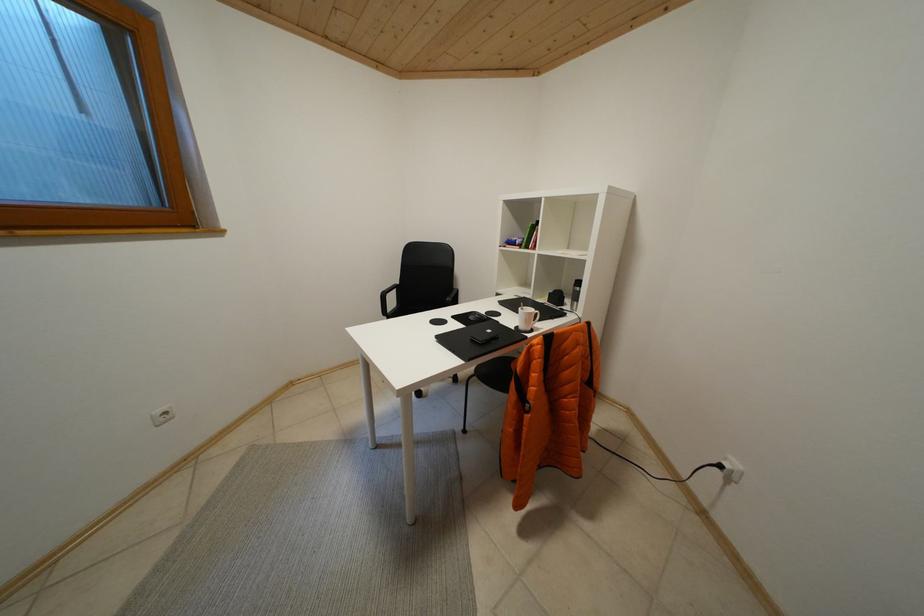
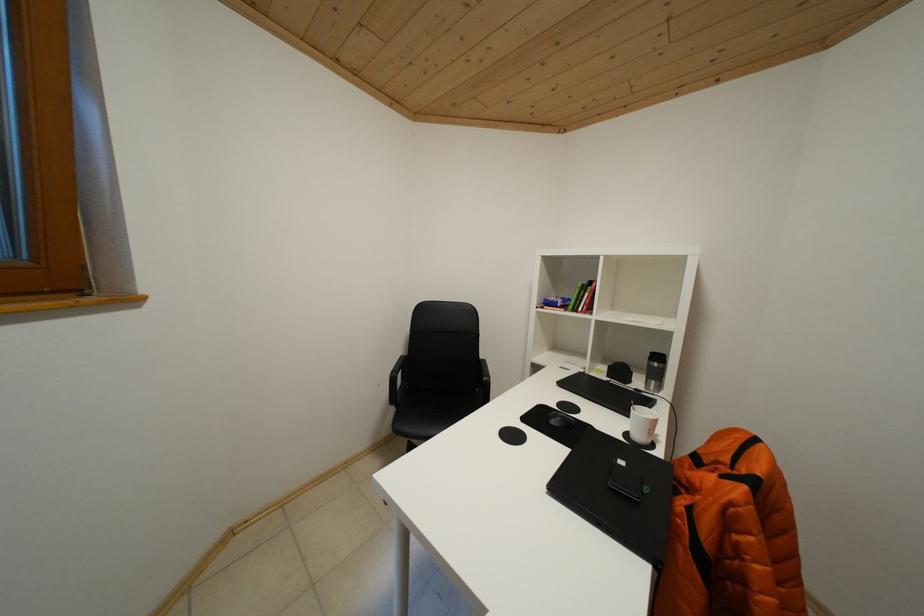
Question: The camera is either moving clockwise (left) or counter-clockwise (right) around the object. The first image is from the beginning of the video and the second image is from the end. Is the camera moving left or right when shooting the video?

Choices:
 (A) Left
 (B) Right

Answer: (A)